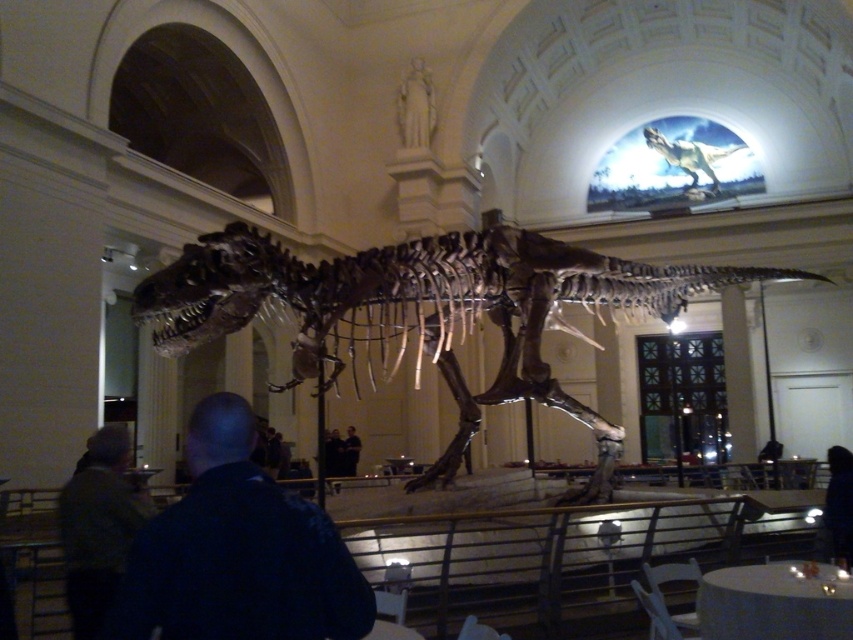
Question: Is dark brown leather jacket at lower left positioned at the back of dark blue shirt at center?

Choices:
 (A) yes
 (B) no

Answer: (B)

Question: Among these objects, which one is nearest to the camera?

Choices:
 (A) shiny metallic skeleton at center
 (B) dark brown leather jacket at lower left

Answer: (B)

Question: Can you confirm if shiny metallic skeleton at center is thinner than dark blue shirt at center?

Choices:
 (A) no
 (B) yes

Answer: (A)

Question: Among these points, which one is nearest to the camera?

Choices:
 (A) (143, 502)
 (B) (347, 458)
 (C) (570, 301)

Answer: (A)

Question: Among these objects, which one is nearest to the camera?

Choices:
 (A) dark blue shirt at center
 (B) shiny metallic skeleton at center
 (C) dark blue shirt at lower left

Answer: (C)

Question: Is shiny metallic skeleton at center below dark brown leather jacket at lower left?

Choices:
 (A) no
 (B) yes

Answer: (A)